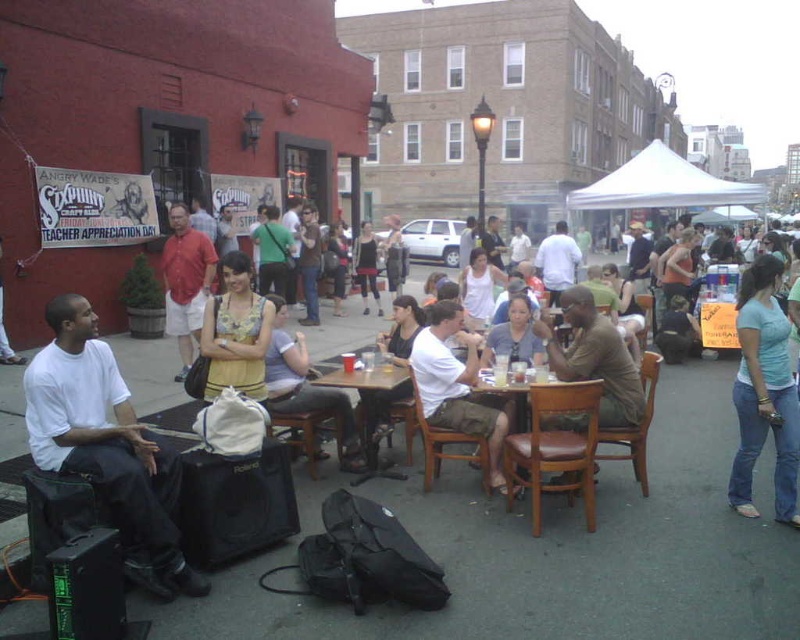
Question: Can you confirm if light blue denim jeans at lower right is smaller than wooden table at center?

Choices:
 (A) yes
 (B) no

Answer: (B)

Question: Which of the following is the farthest from the observer?

Choices:
 (A) (429, 406)
 (B) (374, 410)
 (C) (476, 364)
 (D) (30, 428)

Answer: (B)

Question: Which object is farther from the camera taking this photo?

Choices:
 (A) white matte shirt at left
 (B) brown leather table at center

Answer: (B)

Question: Does wooden table at center have a smaller size compared to brown leather table at center?

Choices:
 (A) yes
 (B) no

Answer: (A)

Question: Which object is positioned closest to the wooden table at center?

Choices:
 (A) white matte shirt at left
 (B) brown leather table at center
 (C) white cotton shirt at center
 (D) light blue denim jeans at lower right

Answer: (C)

Question: Is white matte shirt at left closer to the viewer compared to wooden table at center?

Choices:
 (A) no
 (B) yes

Answer: (B)